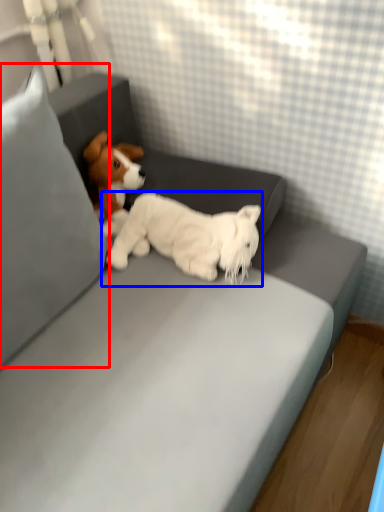
Question: Which object appears closest to the camera in this image, pillow (highlighted by a red box) or dog (highlighted by a blue box)?

Choices:
 (A) pillow
 (B) dog

Answer: (A)